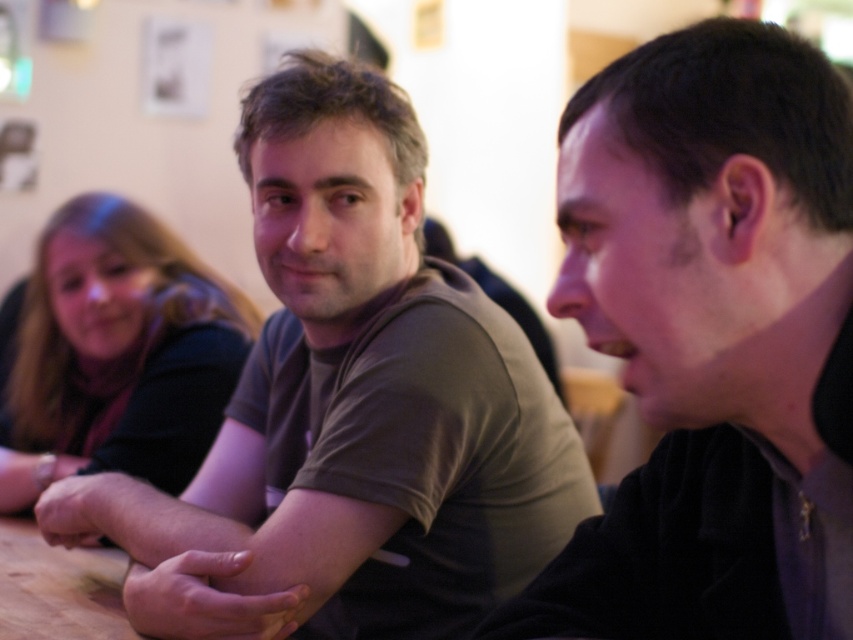
Is brown matte shirt at center behind black matte shirt at center?

Yes, brown matte shirt at center is behind black matte shirt at center.

Is brown matte shirt at center bigger than black matte shirt at center?

Correct, brown matte shirt at center is larger in size than black matte shirt at center.

Identify the location of brown matte shirt at center. This screenshot has width=853, height=640. (349, 410).

The image size is (853, 640). I want to click on brown matte shirt at center, so click(349, 410).

Can you confirm if matte black shirt at upper left is positioned below wooden at lower left?

No.

Between matte black shirt at upper left and wooden at lower left, which one is positioned lower?

wooden at lower left

Between point (173, 257) and point (107, 625), which one is positioned behind?

The point (173, 257) is behind.

In order to click on matte black shirt at upper left in this screenshot , I will do `click(119, 353)`.

Is brown matte shirt at center wider than matte black shirt at upper left?

Correct, the width of brown matte shirt at center exceeds that of matte black shirt at upper left.

Based on the photo, which is more to the left, brown matte shirt at center or matte black shirt at upper left?

matte black shirt at upper left is more to the left.

This screenshot has height=640, width=853. I want to click on brown matte shirt at center, so click(x=349, y=410).